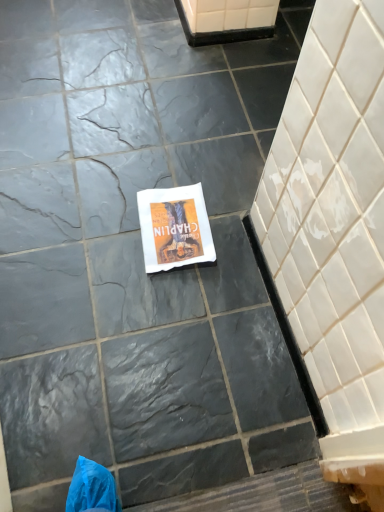
Image resolution: width=384 pixels, height=512 pixels. Identify the location of vacant space to the right of white paper towel at center. 231,238.